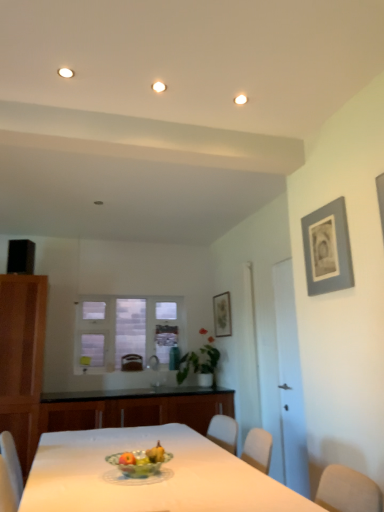
What do you see at coordinates (290, 382) in the screenshot?
I see `white glossy door at right` at bounding box center [290, 382].

What do you see at coordinates (131, 362) in the screenshot? This screenshot has width=384, height=512. I see `brown leather armchair at center` at bounding box center [131, 362].

The height and width of the screenshot is (512, 384). Describe the element at coordinates (134, 408) in the screenshot. I see `black granite countertop at center` at that location.

What is the approximate height of black granite countertop at center?

black granite countertop at center is 25.06 inches tall.

Locate an element on the screen. matte gray picture frame at upper center, the 2th picture frame when ordered from right to left is located at coordinates (222, 315).

Locate an element on the screen. This screenshot has width=384, height=512. white glossy table at center is located at coordinates (149, 477).

I want to click on green leafy plant at center, so click(200, 364).

Between gray matte picture frame at upper right, the first picture frame from the top, and black granite countertop at center, which one appears on the left side from the viewer's perspective?

black granite countertop at center is more to the left.

Considering the relative positions of gray matte picture frame at upper right, the first picture frame from the top, and black granite countertop at center in the image provided, is gray matte picture frame at upper right, the first picture frame from the top, in front of black granite countertop at center?

Yes, gray matte picture frame at upper right, the first picture frame from the top, is in front of black granite countertop at center.

From the image's perspective, would you say gray matte picture frame at upper right, which is counted as the second picture frame, starting from the back, is shown under black granite countertop at center?

No, from the image's perspective, gray matte picture frame at upper right, which is counted as the second picture frame, starting from the back, is not below black granite countertop at center.

Is gray matte picture frame at upper right, the 1th picture frame in the right-to-left sequence, directly adjacent to black granite countertop at center?

No, gray matte picture frame at upper right, the 1th picture frame in the right-to-left sequence, is not beside black granite countertop at center.

Locate an element on the screen. glass door behind the white glossy table at center is located at coordinates (290, 382).

From the image's perspective, which one is positioned lower, white glossy door at right or white glossy table at center?

white glossy table at center, from the image's perspective.

Is the position of white glossy door at right less distant than that of white glossy table at center?

No, white glossy door at right is further to the viewer.

Is white glossy door at right to the left or to the right of white glossy table at center in the image?

From the image, it's evident that white glossy door at right is to the right of white glossy table at center.

Is white glossy table at center touching white glass window at center?

No, white glossy table at center is not with white glass window at center.

Is white glossy table at center thinner than white glass window at center?

No, white glossy table at center is not thinner than white glass window at center.

Does white glossy table at center contain white glass window at center?

No, white glass window at center is not inside white glossy table at center.

Where is `window that appears on the left of white glossy table at center`? This screenshot has height=512, width=384. window that appears on the left of white glossy table at center is located at coordinates point(126,330).

Is green leafy plant at center at the left side of white glossy table at center?

Incorrect, green leafy plant at center is not on the left side of white glossy table at center.

Considering the relative positions of green leafy plant at center and white glossy table at center in the image provided, is green leafy plant at center behind white glossy table at center?

Yes, green leafy plant at center is further from the viewer.

Considering the points (200, 379) and (81, 467), which point is behind, point (200, 379) or point (81, 467)?

Point (200, 379)

Does green leafy plant at center turn towards white glossy table at center?

No, green leafy plant at center is not facing towards white glossy table at center.

From the image's perspective, between white glossy door at right and black granite countertop at center, which one is located above?

white glossy door at right.

What's the angular difference between white glossy door at right and black granite countertop at center's facing directions?

The angle between the facing direction of white glossy door at right and the facing direction of black granite countertop at center is 89.9 degrees.

Image resolution: width=384 pixels, height=512 pixels. I want to click on counter top located behind the white glossy door at right, so click(134, 408).

Based on the photo, which is in front, white glossy door at right or black granite countertop at center?

white glossy door at right is closer to the camera.

At what (x,y) coordinates should I click in order to perform the action: click on counter top located underneath the white glass window at center (from a real-world perspective). Please return your answer as a coordinate pair (x, y). The image size is (384, 512). Looking at the image, I should click on (134, 408).

Between white glass window at center and black granite countertop at center, which one has more height?

Standing taller between the two is white glass window at center.

From a real-world perspective, is white glass window at center on black granite countertop at center?

Yes, from a real-world perspective, white glass window at center is over black granite countertop at center

Which is more distant, [129,470] or [72,404]?

The point [72,404] is farther.

Can you tell me how much green glass bowl at center and black granite countertop at center differ in facing direction?

green glass bowl at center and black granite countertop at center are facing 3.91 degrees away from each other.

From the image's perspective, between green glass bowl at center and black granite countertop at center, who is located below?

black granite countertop at center is shown below in the image.

Identify the location of counter top that appears below the green glass bowl at center (from a real-world perspective). (134, 408).

There is a black granite countertop at center. What are the coordinates of `the 2nd picture frame above it (from the image's perspective)` in the screenshot? It's located at (327, 249).

Where is `table below the white glossy door at right (from the image's perspective)`? The height and width of the screenshot is (512, 384). table below the white glossy door at right (from the image's perspective) is located at coordinates (149, 477).

Considering their positions, is white glossy table at center positioned further to black granite countertop at center than matte gray picture frame at upper center, the 1th picture frame when ordered from back to front?

white glossy table at center.

Considering their positions, is brown leather armchair at center positioned closer to green leafy plant at center than white glossy table at center?

The object closer to green leafy plant at center is brown leather armchair at center.

Based on the photo, looking at the image, which one is located closer to white glass window at center, matte gray picture frame at upper center, acting as the first picture frame starting from the left, or green leafy plant at center?

Based on the image, green leafy plant at center appears to be nearer to white glass window at center.

From the image, which object appears to be nearer to black granite countertop at center, white glass window at center or green glass bowl at center?

Among the two, white glass window at center is located nearer to black granite countertop at center.

Based on their spatial positions, is matte gray picture frame at upper center, which ranks as the 2th picture frame in top-to-bottom order, or green leafy plant at center closer to white glossy door at right?

Based on the image, matte gray picture frame at upper center, which ranks as the 2th picture frame in top-to-bottom order, appears to be nearer to white glossy door at right.

From the image, which object appears to be farther from brown leather armchair at center, black granite countertop at center or white glass window at center?

black granite countertop at center lies further to brown leather armchair at center than the other object.

From the picture: Which object lies nearer to the anchor point white glass window at center, white glossy door at right or matte gray picture frame at upper center, the 1th picture frame when ordered from back to front?

matte gray picture frame at upper center, the 1th picture frame when ordered from back to front, lies closer to white glass window at center than the other object.

Consider the image. Based on their spatial positions, is white glossy door at right or white glass window at center further from green glass bowl at center?

white glass window at center.

Locate an element on the screen. The height and width of the screenshot is (512, 384). picture frame located between green glass bowl at center and black granite countertop at center in the depth direction is located at coordinates (327, 249).

The height and width of the screenshot is (512, 384). Identify the location of glass door positioned between green glass bowl at center and matte gray picture frame at upper center, which ranks as the 2th picture frame in top-to-bottom order, from near to far. (290, 382).

Where is `glass door between white glossy table at center and green leafy plant at center in the front-back direction`? This screenshot has width=384, height=512. glass door between white glossy table at center and green leafy plant at center in the front-back direction is located at coordinates tap(290, 382).

Locate an element on the screen. Image resolution: width=384 pixels, height=512 pixels. glass door between gray matte picture frame at upper right, marked as the second picture frame in a left-to-right arrangement, and brown leather armchair at center in the front-back direction is located at coordinates (290, 382).